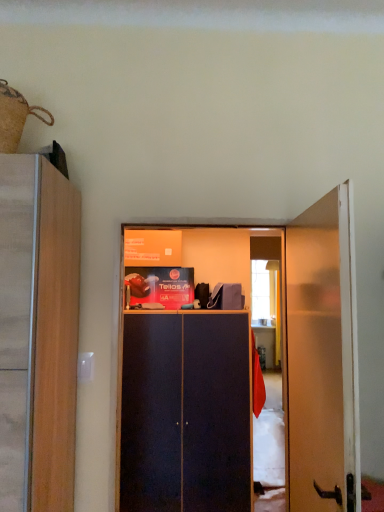
Locate an element on the screen. The image size is (384, 512). dark wood cabinet at center is located at coordinates (185, 413).

You are a GUI agent. You are given a task and a screenshot of the screen. Output one action in this format:
    pyautogui.click(x=<x>, y=<y>)
    Task: Click on the burlap sack at upper left
    
    Given the screenshot: What is the action you would take?
    pyautogui.click(x=16, y=117)

Is the surface of dark wood cabinet at center in direct contact with wooden door at right?

There is a gap between dark wood cabinet at center and wooden door at right.

Considering the sizes of dark wood cabinet at center and wooden door at right in the image, is dark wood cabinet at center taller or shorter than wooden door at right?

Clearly, dark wood cabinet at center is taller compared to wooden door at right.

From the image's perspective, is dark wood cabinet at center beneath wooden door at right?

Indeed, from the image's perspective, dark wood cabinet at center is shown beneath wooden door at right.

Considering the relative positions of dark wood cabinet at center and wooden door at right in the image provided, is dark wood cabinet at center to the left of wooden door at right from the viewer's perspective?

Yes, dark wood cabinet at center is to the left of wooden door at right.

Which of these two, wooden door at right or dark wood cabinet at center, stands taller?

dark wood cabinet at center.

Are wooden door at right and dark wood cabinet at center beside each other?

There is a gap between wooden door at right and dark wood cabinet at center.

Measure the distance between wooden door at right and dark wood cabinet at center.

A distance of 4.50 feet exists between wooden door at right and dark wood cabinet at center.

From the image's perspective, is wooden door at right above or below dark wood cabinet at center?

From the image's perspective, wooden door at right appears above dark wood cabinet at center.

Between burlap sack at upper left and wooden door at right, which one is positioned in front?

wooden door at right is more forward.

Which of these two, burlap sack at upper left or wooden door at right, is thinner?

wooden door at right.

Is wooden door at right inside burlap sack at upper left?

That's incorrect, wooden door at right is not inside burlap sack at upper left.

Is burlap sack at upper left at the back of wooden door at right?

No.

Are wooden door at right and burlap sack at upper left far apart?

Yes, wooden door at right is far from burlap sack at upper left.

From the image's perspective, would you say wooden door at right is positioned over burlap sack at upper left?

No, from the image's perspective, wooden door at right is not above burlap sack at upper left.

Which of these two, burlap sack at upper left or dark wood cabinet at center, stands shorter?

With less height is burlap sack at upper left.

Considering the positions of objects burlap sack at upper left and dark wood cabinet at center in the image provided, who is more to the right, burlap sack at upper left or dark wood cabinet at center?

dark wood cabinet at center.

Locate an element on the screen. houseplant located in front of the dark wood cabinet at center is located at coordinates (16, 117).

From the image's perspective, is burlap sack at upper left beneath dark wood cabinet at center?

Actually, burlap sack at upper left appears above dark wood cabinet at center in the image.

Is point (188, 360) positioned behind point (9, 138)?

Yes, point (188, 360) is behind point (9, 138).

Can you tell me how much dark wood cabinet at center and burlap sack at upper left differ in facing direction?

There is a 2.93-degree angle between the facing directions of dark wood cabinet at center and burlap sack at upper left.

Is the depth of dark wood cabinet at center less than that of burlap sack at upper left?

No, dark wood cabinet at center is further to the viewer.

Considering the sizes of objects dark wood cabinet at center and burlap sack at upper left in the image provided, who is taller, dark wood cabinet at center or burlap sack at upper left?

dark wood cabinet at center is taller.

Find the location of a particular element. door that appears on the right of dark wood cabinet at center is located at coordinates (323, 356).

Locate an element on the screen. The width and height of the screenshot is (384, 512). screen door that is under the wooden door at right (from a real-world perspective) is located at coordinates (185, 413).

Based on their spatial positions, is wooden door at right or dark wood cabinet at center closer to burlap sack at upper left?

wooden door at right lies closer to burlap sack at upper left than the other object.

When comparing their distances from burlap sack at upper left, does dark wood cabinet at center or wooden door at right seem closer?

wooden door at right lies closer to burlap sack at upper left than the other object.

From the image, which object appears to be nearer to wooden door at right, burlap sack at upper left or dark wood cabinet at center?

The object closer to wooden door at right is dark wood cabinet at center.

Looking at the image, which one is located further to wooden door at right, dark wood cabinet at center or burlap sack at upper left?

burlap sack at upper left.

From the picture: When comparing their distances from dark wood cabinet at center, does burlap sack at upper left or wooden door at right seem further?

burlap sack at upper left.

Which object lies further to the anchor point dark wood cabinet at center, wooden door at right or burlap sack at upper left?

burlap sack at upper left is positioned further to the anchor dark wood cabinet at center.

Where is `houseplant between wooden door at right and dark wood cabinet at center from front to back`? The height and width of the screenshot is (512, 384). houseplant between wooden door at right and dark wood cabinet at center from front to back is located at coordinates (16, 117).